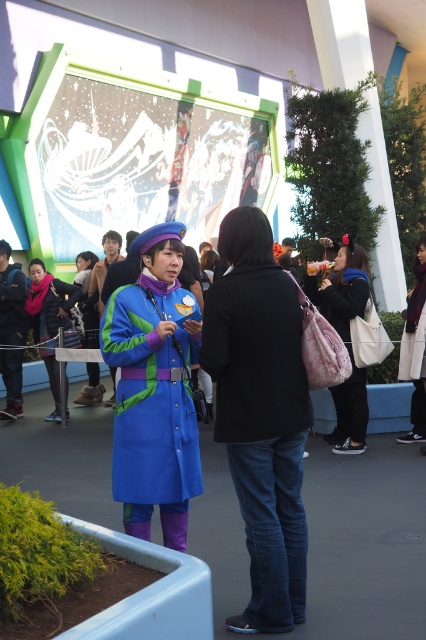
Is point (276, 413) farther from viewer compared to point (420, 403)?

No, (276, 413) is in front of (420, 403).

Is point (264, 412) closer to camera compared to point (420, 349)?

Yes, point (264, 412) is closer to viewer.

Where is `black matte coat at center`? black matte coat at center is located at coordinates (255, 355).

Is black matte jacket at center thinner than matte black jacket at center?

Correct, black matte jacket at center's width is less than matte black jacket at center's.

Is black matte jacket at center below matte black jacket at center?

Indeed, black matte jacket at center is positioned under matte black jacket at center.

Does point (236, 464) come in front of point (34, 337)?

Yes, point (236, 464) is closer to viewer.

Identify the location of black matte jacket at center. The height and width of the screenshot is (640, 426). (261, 413).

Can you confirm if white cotton dress at center is positioned above blue fabric coat at center?

No.

Can you confirm if white cotton dress at center is positioned to the left of blue fabric coat at center?

No, white cotton dress at center is not to the left of blue fabric coat at center.

Does point (414, 268) come in front of point (104, 273)?

Yes, point (414, 268) is in front of point (104, 273).

I want to click on white cotton dress at center, so click(416, 344).